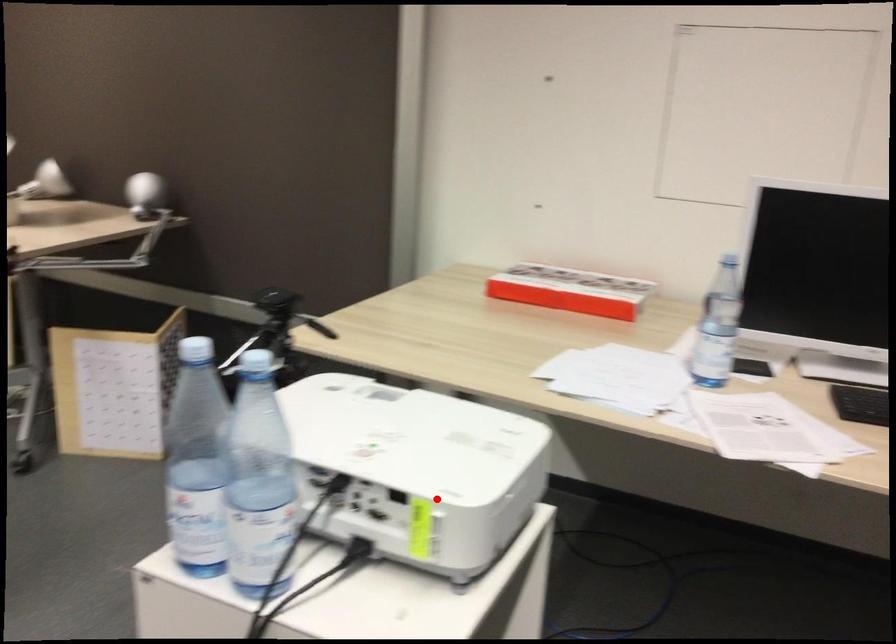
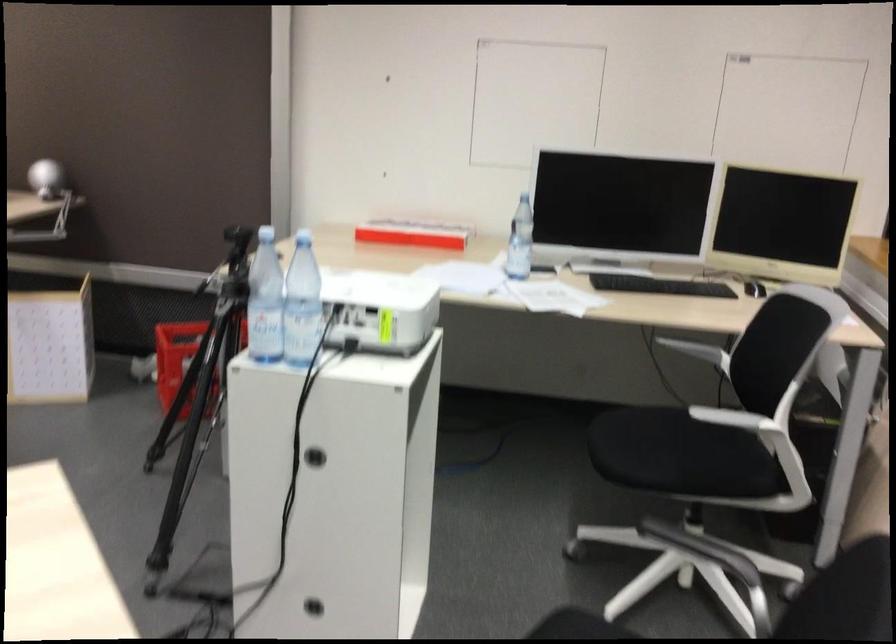
Where in the second image is the point corresponding to the highlighted location from the first image?

(380, 308)